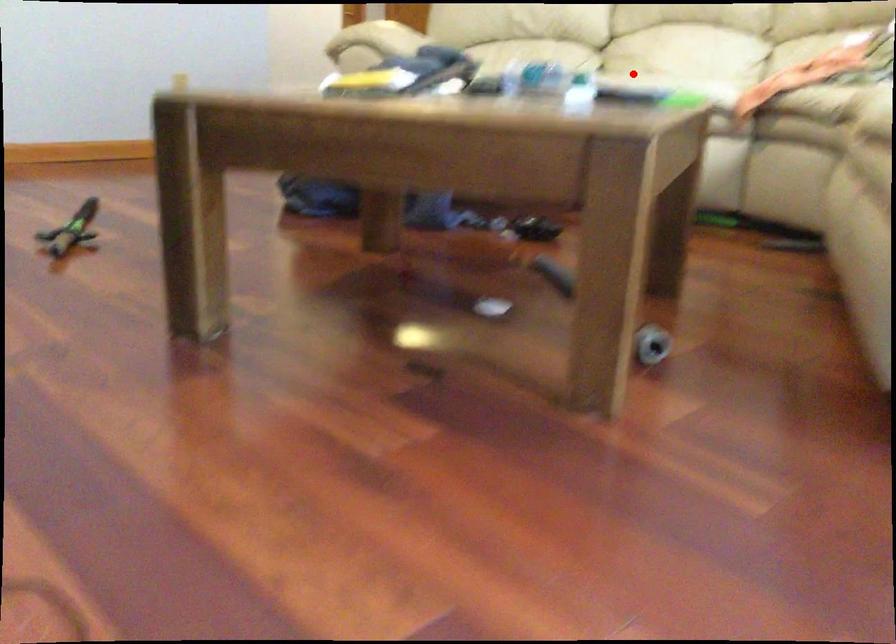
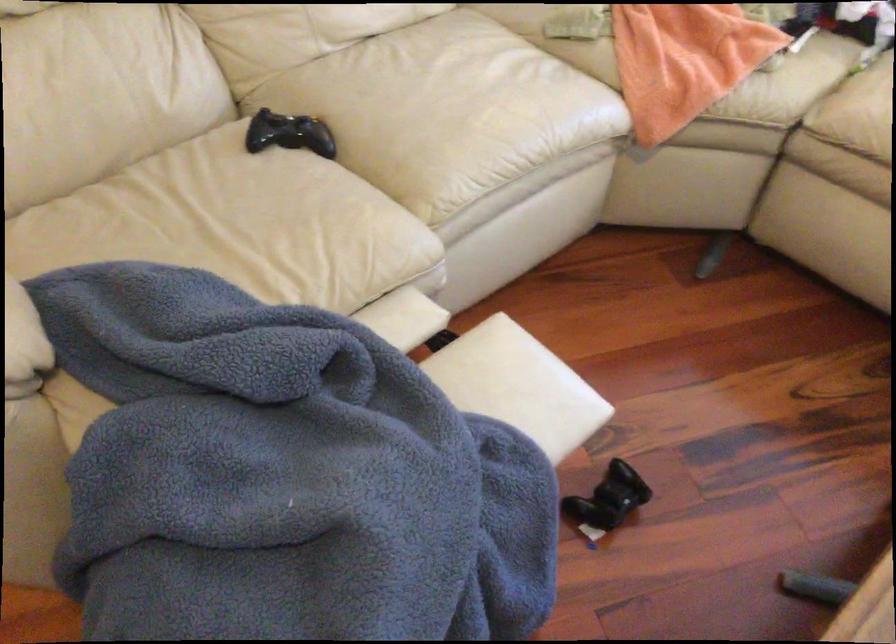
Question: I am providing you with two images of the same scene from different viewpoints. Given a red point in image1, look at the same physical point in image2. Is it:

Choices:
 (A) Closer to the viewpoint
 (B) Farther from the viewpoint

Answer: (A)